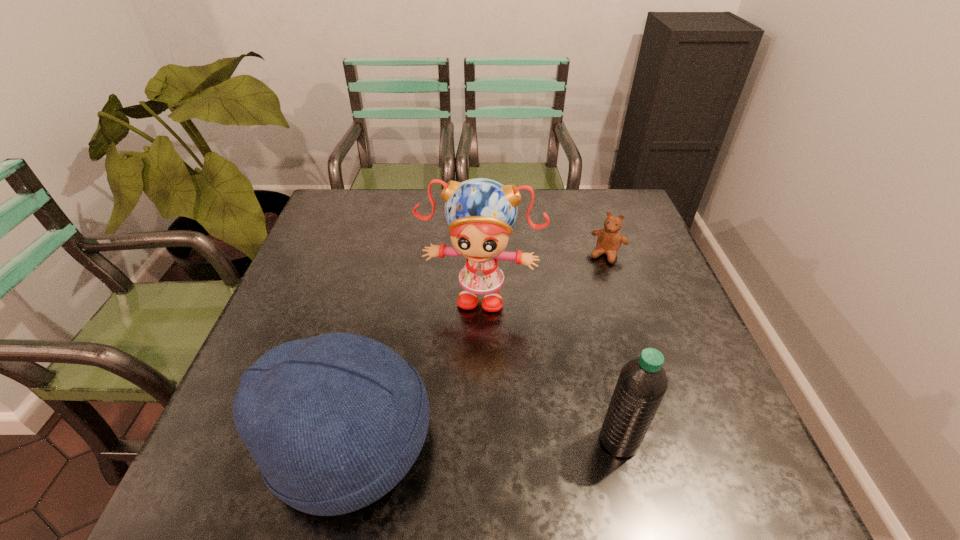
In the image, there is a desktop. Find the location of `vacant space at the near edge`. vacant space at the near edge is located at coordinates (564, 426).

Find the location of `vacant area at the left edge of the desktop`. vacant area at the left edge of the desktop is located at coordinates (333, 296).

In the image, there is a desktop. Where is `vacant area at the far left corner`? The height and width of the screenshot is (540, 960). vacant area at the far left corner is located at coordinates (336, 192).

The width and height of the screenshot is (960, 540). Find the location of `free space at the far right corner of the desktop`. free space at the far right corner of the desktop is located at coordinates (622, 198).

At what (x,y) coordinates should I click in order to perform the action: click on blank space at the near right corner of the desktop. Please return your answer as a coordinate pair (x, y). Looking at the image, I should click on (733, 427).

I want to click on unoccupied position between the tallest object and the skullcap, so coord(415,366).

Locate an element on the screen. Image resolution: width=960 pixels, height=540 pixels. free space between the water bottle and the shortest object is located at coordinates (613, 347).

The image size is (960, 540). Identify the location of free space that is in between the skullcap and the water bottle. (484, 441).

You are a GUI agent. You are given a task and a screenshot of the screen. Output one action in this format:
    pyautogui.click(x=<x>, y=<y>)
    Task: Click on the blank region between the water bottle and the skullcap
    The image size is (960, 540).
    Given the screenshot: What is the action you would take?
    pyautogui.click(x=484, y=441)

Locate an element on the screen. free space between the skullcap and the second object from right to left is located at coordinates (484, 441).